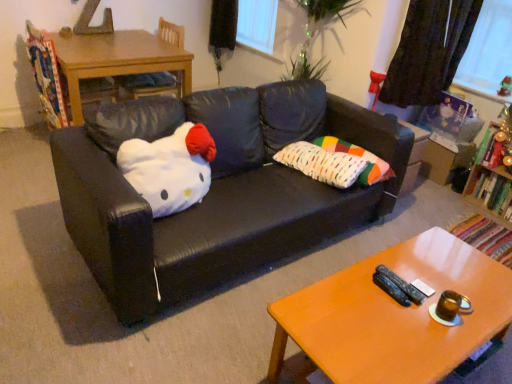
The height and width of the screenshot is (384, 512). I want to click on free point above orange wood coffee table at lower right (from a real-world perspective), so click(x=393, y=303).